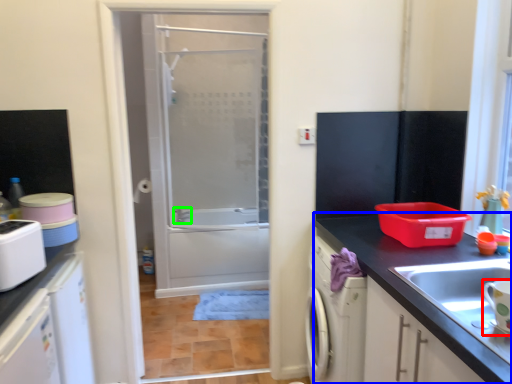
Question: Based on their relative distances, which object is nearer to appliance (highlighted by a red box)? Choose from countertop (highlighted by a blue box) and faucet (highlighted by a green box).

Choices:
 (A) countertop
 (B) faucet

Answer: (A)